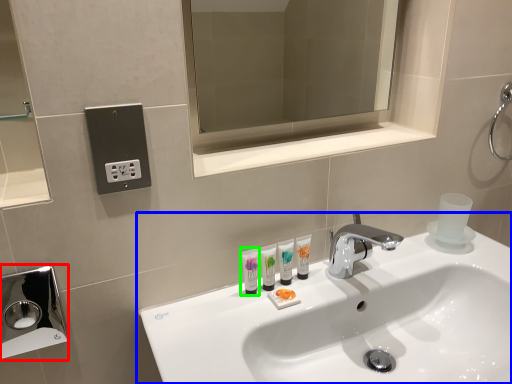
Question: Which object is the farthest from hand dryer (highlighted by a red box)? Choose among these: sink (highlighted by a blue box) or mouthwash (highlighted by a green box).

Choices:
 (A) sink
 (B) mouthwash

Answer: (B)